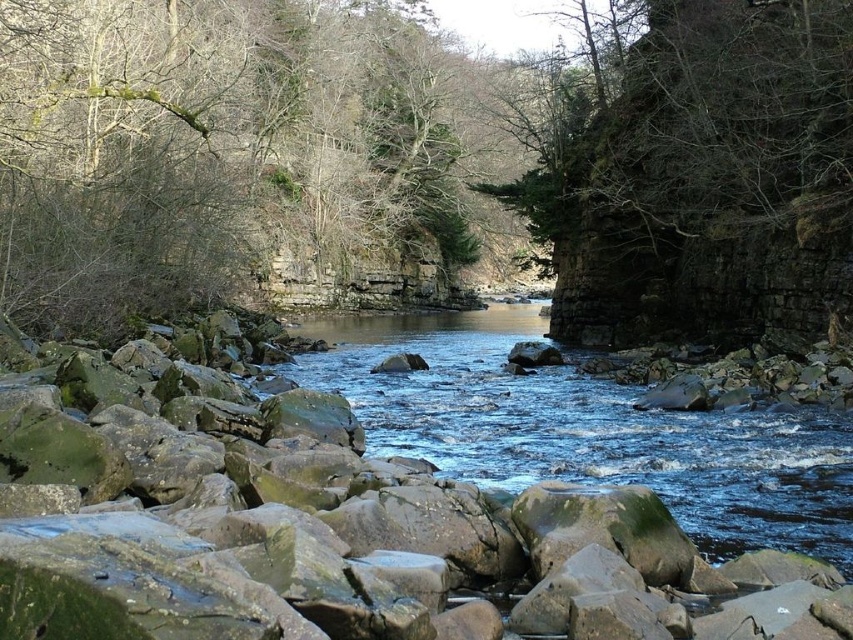
You are a hiker who wants to take a photo of the green mossy tree at center from a safe distance. What is the minimum distance you need to maintain to ensure you can capture the entire tree in your camera frame?

The minimum distance you need to maintain to capture the entire green mossy tree at center in your camera frame is 27.79 meters, as this is the distance between the viewer and the tree.

You are a hiker trying to cross the river at the center. The green mossy tree at center and the clear water at center are in your path. Which object is wider, making it harder to navigate around?

The green mossy tree at center might be wider than clear water at center, so it could be harder to navigate around.

You are a hiker trying to cross the river. You see the green mossy tree at center and the clear water at center. Which object is higher in elevation?

The green mossy tree at center is taller than the clear water at center, so the green mossy tree at center is higher in elevation.